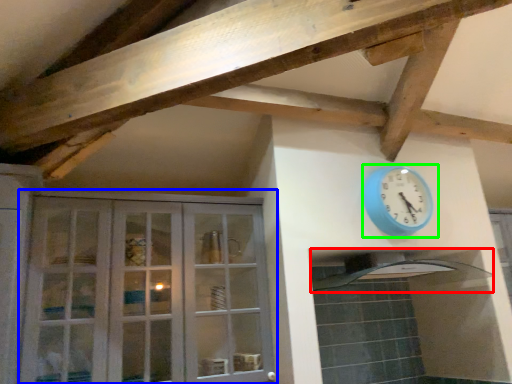
Question: Which object is the closest to the exhaust hood (highlighted by a red box)? Choose among these: cabinetry (highlighted by a blue box) or wall clock (highlighted by a green box).

Choices:
 (A) cabinetry
 (B) wall clock

Answer: (B)